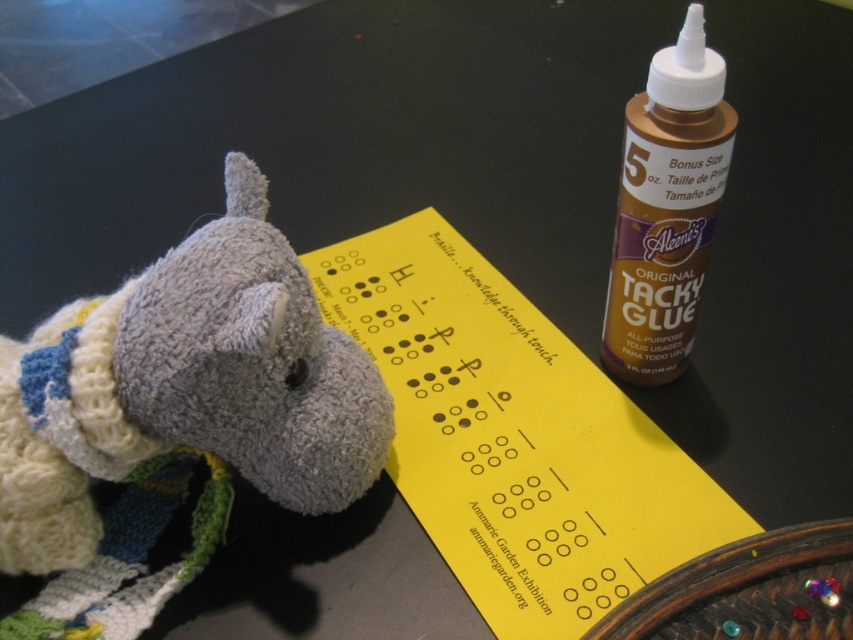
You are an artist creating a tactile art piece. You have a knitted gray horse at lower left and a yellow paper with Braille text in the center. Which object is closer to the point marked at coordinates (181, 401)?

The knitted gray horse at lower left is represented by point (181, 401), so it is exactly at that coordinate. The yellow paper with Braille text is in the center, so the knitted gray horse at lower left is closer to the point.

Where is the knitted gray horse at lower left located in the image?

The knitted gray horse at lower left is located at point (181, 401) in the image.